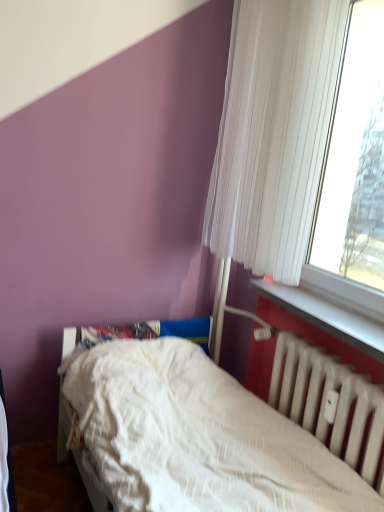
Question: From a real-world perspective, is white pleated curtain at upper right located higher than white textured bed at lower center?

Choices:
 (A) yes
 (B) no

Answer: (A)

Question: Is white pleated curtain at upper right to the right of white textured bed at lower center from the viewer's perspective?

Choices:
 (A) yes
 (B) no

Answer: (A)

Question: Would you say white textured bed at lower center is part of white pleated curtain at upper right's contents?

Choices:
 (A) yes
 (B) no

Answer: (B)

Question: Does white pleated curtain at upper right come in front of white textured bed at lower center?

Choices:
 (A) no
 (B) yes

Answer: (A)

Question: From the image's perspective, does white pleated curtain at upper right appear higher than white textured bed at lower center?

Choices:
 (A) no
 (B) yes

Answer: (B)

Question: Is white matte radiator at lower right wider or thinner than white pleated curtain at upper right?

Choices:
 (A) wide
 (B) thin

Answer: (B)

Question: Choose the correct answer: Is white matte radiator at lower right inside white pleated curtain at upper right or outside it?

Choices:
 (A) inside
 (B) outside

Answer: (B)

Question: Is point (304, 421) positioned closer to the camera than point (236, 219)?

Choices:
 (A) farther
 (B) closer

Answer: (B)

Question: In the image, is white matte radiator at lower right positioned in front of or behind white pleated curtain at upper right?

Choices:
 (A) front
 (B) behind

Answer: (A)

Question: In terms of size, does white pleated curtain at upper right appear bigger or smaller than white plastic window sill at lower right?

Choices:
 (A) small
 (B) big

Answer: (B)

Question: From a real-world perspective, is white pleated curtain at upper right physically located above or below white plastic window sill at lower right?

Choices:
 (A) below
 (B) above

Answer: (B)

Question: Is white pleated curtain at upper right taller or shorter than white plastic window sill at lower right?

Choices:
 (A) tall
 (B) short

Answer: (A)

Question: Considering their positions, is white pleated curtain at upper right located in front of or behind white plastic window sill at lower right?

Choices:
 (A) behind
 (B) front

Answer: (A)

Question: Is point (349, 318) positioned closer to the camera than point (162, 346)?

Choices:
 (A) farther
 (B) closer

Answer: (B)

Question: Considering the positions of white plastic window sill at lower right and white textured bed at lower center in the image, is white plastic window sill at lower right taller or shorter than white textured bed at lower center?

Choices:
 (A) short
 (B) tall

Answer: (A)